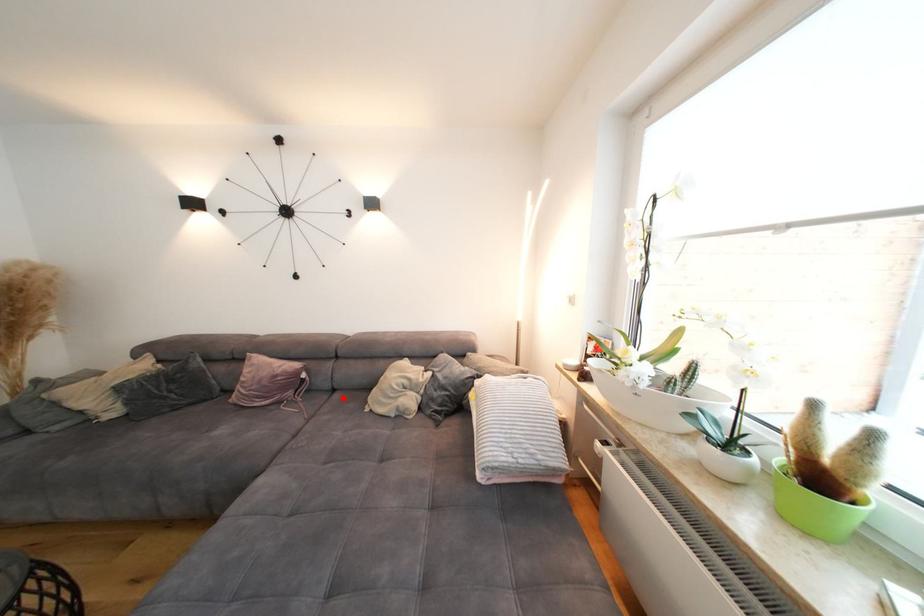
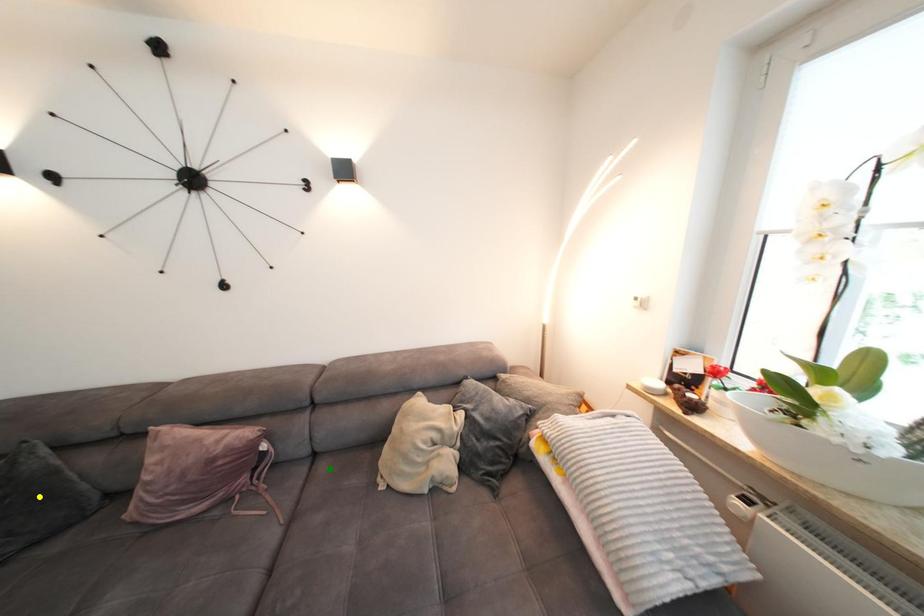
Question: I am providing you with two images of the same scene from different viewpoints. A red point is marked on the first image. You are given multiple points on the second image. Can you choose the point in image 2 that corresponds to the point in image 1?

Choices:
 (A) green point
 (B) blue point
 (C) yellow point

Answer: (A)